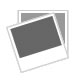
In order to click on polaroid under other polaroid in this screenshot , I will do `click(62, 20)`.